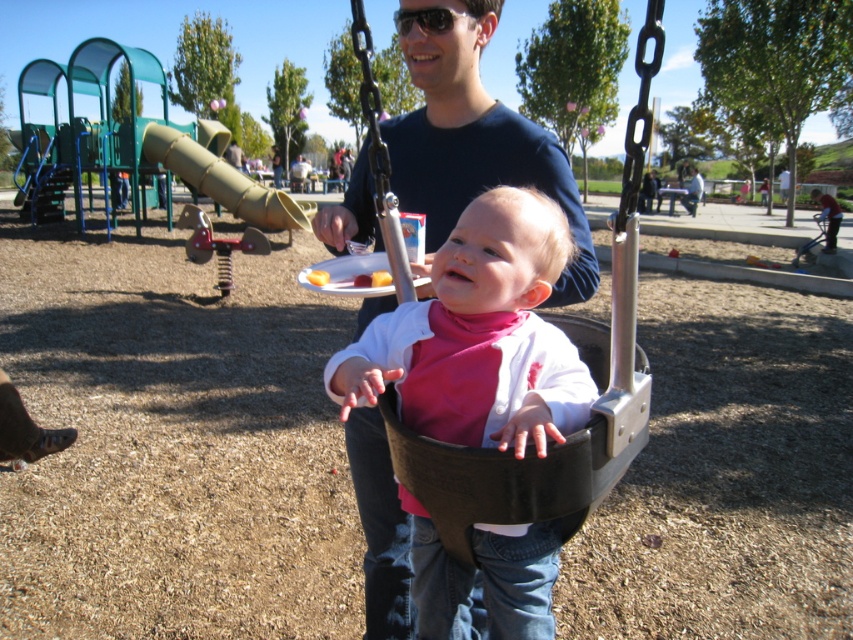
You are a parent at the playground and want to ensure the baby is safe while swinging. The baby is wearing the pink matte bib at center and sitting in the black plastic swing at center. Where is the pink matte bib located in relation to the swing?

The pink matte bib at center is below the black plastic swing at center, so it is positioned underneath the swing where the baby can easily access it while sitting.

You are a parent at the playground and want to give the baby a snack. The baby is sitting in the black plastic swing at center, and you have a pink matte bib at center. Can you reach the baby with the bib without moving closer than 6 inches?

The distance between the pink matte bib at center and the black plastic swing at center is 5.98 inches, so yes, you can reach the baby with the bib without moving closer than 6 inches since the distance is just under 6 inches.